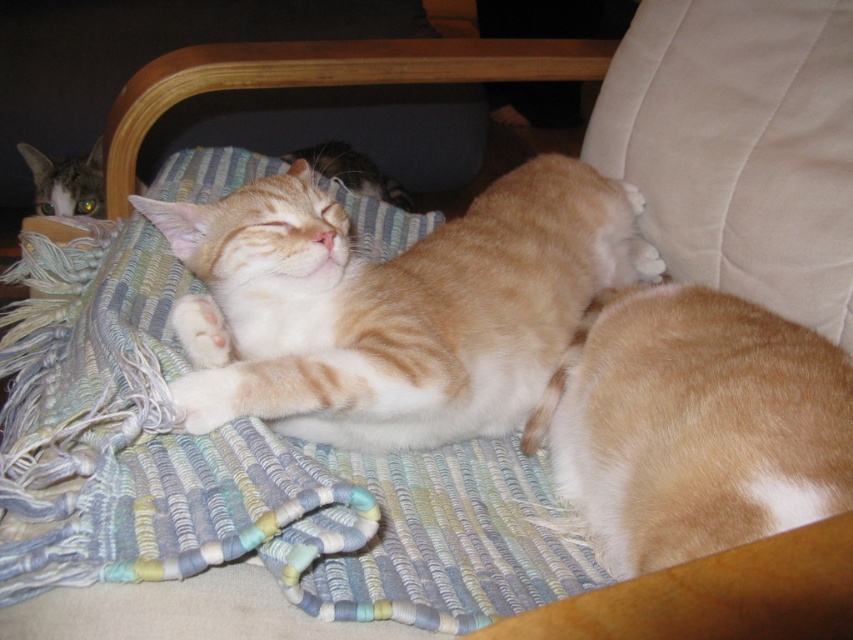
Question: Can you confirm if orange tabby cat at center is smaller than tabby fur cat at upper left?

Choices:
 (A) no
 (B) yes

Answer: (A)

Question: Which point is farther from the camera taking this photo?

Choices:
 (A) (74, 177)
 (B) (717, 324)

Answer: (A)

Question: Does orange tabby cat at center have a lesser width compared to orange fur cat at center?

Choices:
 (A) no
 (B) yes

Answer: (A)

Question: Can you confirm if golden fur cat at center is positioned above tabby fur cat at upper left?

Choices:
 (A) yes
 (B) no

Answer: (B)

Question: Which point appears farthest from the camera in this image?

Choices:
 (A) (761, 440)
 (B) (322, 163)

Answer: (B)

Question: Among these points, which one is nearest to the camera?

Choices:
 (A) (44, 193)
 (B) (379, 192)

Answer: (B)